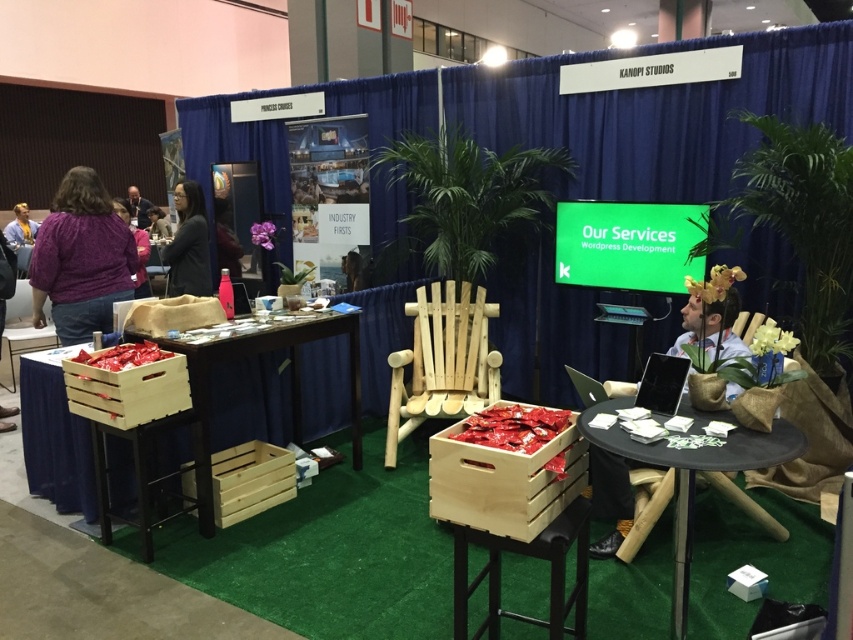
Question: Which point appears closest to the camera in this image?

Choices:
 (A) [x=209, y=513]
 (B) [x=193, y=284]
 (C) [x=714, y=280]
 (D) [x=415, y=419]

Answer: (C)

Question: Estimate the real-world distances between objects in this image. Which object is farther from the natural wood chair at center?

Choices:
 (A) wooden crate at lower left
 (B) light wood stool at center
 (C) black fabric jacket at upper left
 (D) wooden crate at center

Answer: (C)

Question: Among these objects, which one is farthest from the camera?

Choices:
 (A) matte black jacket at upper left
 (B) natural wood chair at center
 (C) black fabric jacket at upper left
 (D) light wood stool at center

Answer: (A)

Question: Does wooden chair at center come in front of matte black shirt at upper left?

Choices:
 (A) no
 (B) yes

Answer: (B)

Question: Is wooden crate at lower left positioned before matte black jacket at upper left?

Choices:
 (A) no
 (B) yes

Answer: (B)

Question: Is wooden crates at lower left thinner than black glossy laptop at center?

Choices:
 (A) no
 (B) yes

Answer: (A)